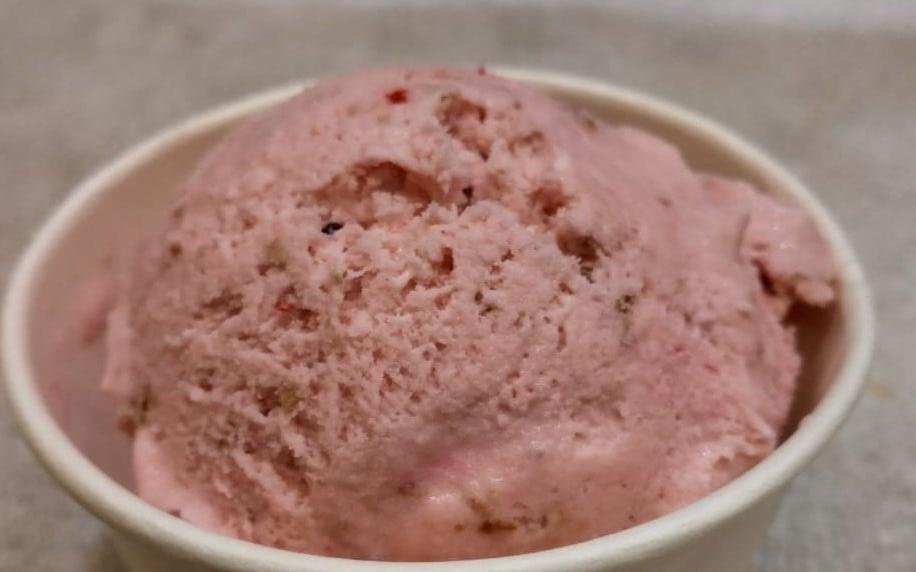
Image resolution: width=916 pixels, height=572 pixels. In order to click on small spot on table toward bottom right in this screenshot , I will do 885,391.